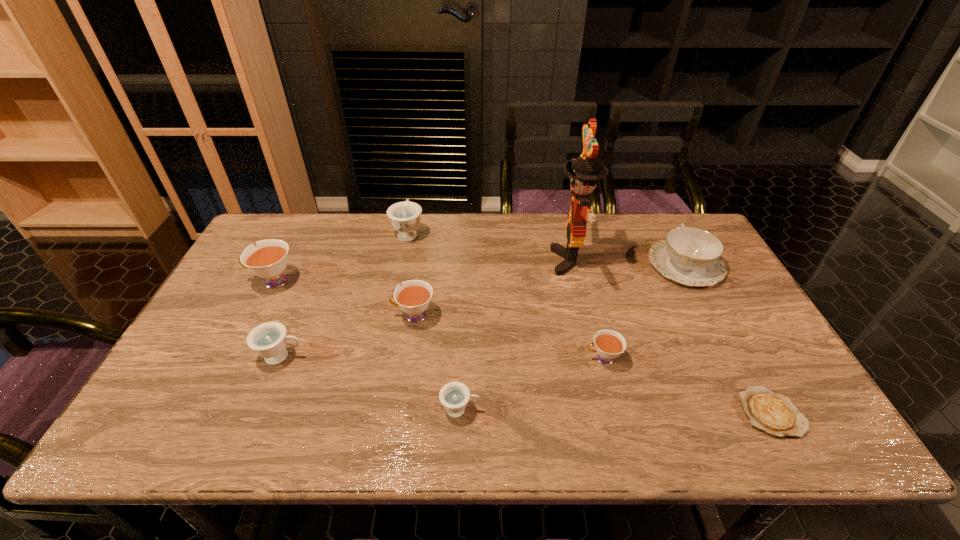
Find the location of `vacant region located on the handle side of the chinaware`. vacant region located on the handle side of the chinaware is located at coordinates (665, 227).

Where is `free region located on the handle side of the chinaware`? This screenshot has height=540, width=960. free region located on the handle side of the chinaware is located at coordinates (668, 233).

This screenshot has height=540, width=960. Identify the location of vacant area situated on the handle side of the chinaware. (665, 227).

Find the location of a particular element. The height and width of the screenshot is (540, 960). free space located 0.150m on the side of the fourth nearest teacup with the handle is located at coordinates (338, 316).

Locate an element on the screen. This screenshot has width=960, height=540. blank area located on the side of the fourth nearest teacup with the handle is located at coordinates (270, 316).

You are a GUI agent. You are given a task and a screenshot of the screen. Output one action in this format:
    pyautogui.click(x=<x>, y=<y>)
    Task: Click on the vacant region located on the side of the fourth nearest teacup with the handle
    
    Given the screenshot: What is the action you would take?
    pyautogui.click(x=270, y=316)

At what (x,y) coordinates should I click in order to perform the action: click on vacant space located 0.220m on the side of the second biggest blue teacup with the handle. Please return your answer as a coordinate pair (x, y). The height and width of the screenshot is (540, 960). Looking at the image, I should click on (392, 356).

Locate an element on the screen. The image size is (960, 540). vacant space located on the side of the smallest white teacup with the handle is located at coordinates (562, 359).

Where is `vacant point located on the side of the smallest white teacup with the handle`? The width and height of the screenshot is (960, 540). vacant point located on the side of the smallest white teacup with the handle is located at coordinates (494, 359).

Where is `vacant area located on the side of the smallest white teacup with the handle`? Image resolution: width=960 pixels, height=540 pixels. vacant area located on the side of the smallest white teacup with the handle is located at coordinates (538, 359).